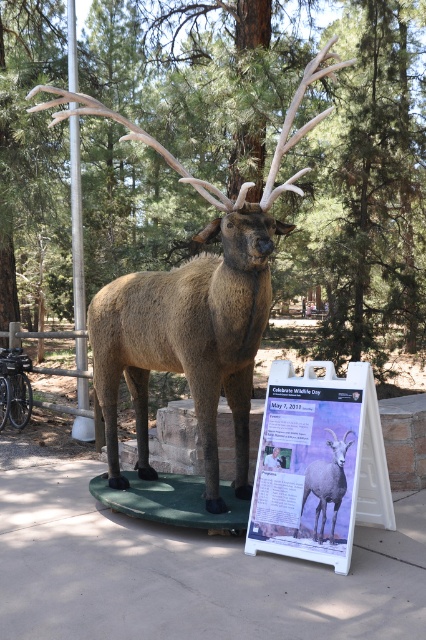
Question: Considering the relative positions of brown matte deer at center and gray woolly sheep at center in the image provided, where is brown matte deer at center located with respect to gray woolly sheep at center?

Choices:
 (A) above
 (B) below

Answer: (A)

Question: Which is nearer to the brown matte deer at center?

Choices:
 (A) gray woolly sheep at center
 (B) matte white signboard at center

Answer: (B)

Question: Is matte white signboard at center thinner than gray woolly sheep at center?

Choices:
 (A) yes
 (B) no

Answer: (B)

Question: Is the position of brown matte deer at center less distant than that of gray woolly sheep at center?

Choices:
 (A) yes
 (B) no

Answer: (A)

Question: Which of the following is the closest to the observer?

Choices:
 (A) matte white signboard at center
 (B) gray woolly sheep at center
 (C) brown matte deer at center

Answer: (C)

Question: Which of the following is the farthest from the observer?

Choices:
 (A) gray woolly sheep at center
 (B) matte white signboard at center
 (C) brown matte deer at center

Answer: (A)